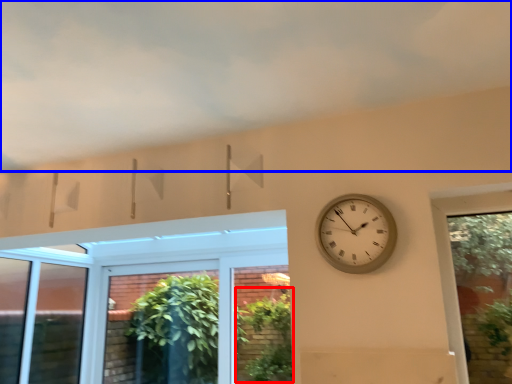
Question: Which point is closer to the camera, plant (highlighted by a red box) or cloud (highlighted by a blue box)?

Choices:
 (A) plant
 (B) cloud

Answer: (B)